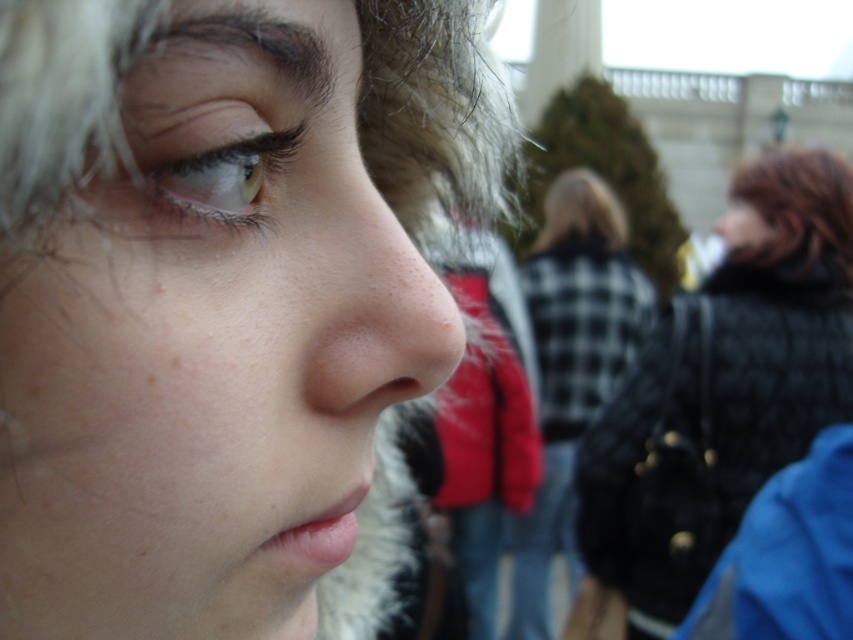
Looking at this image, measure the distance from plaid fabric coat at center to smooth skin nose at center.

plaid fabric coat at center is 29.74 meters from smooth skin nose at center.

What do you see at coordinates (572, 365) in the screenshot?
I see `plaid fabric coat at center` at bounding box center [572, 365].

The image size is (853, 640). Find the location of `plaid fabric coat at center`. plaid fabric coat at center is located at coordinates (572, 365).

Is black quilted coat at upper right shorter than matte black nose at center?

No, black quilted coat at upper right is not shorter than matte black nose at center.

The height and width of the screenshot is (640, 853). Describe the element at coordinates (723, 388) in the screenshot. I see `black quilted coat at upper right` at that location.

Locate an element on the screen. black quilted coat at upper right is located at coordinates [x=723, y=388].

Can you confirm if blondehair at center is positioned above smooth skin nose at center?

Yes, blondehair at center is above smooth skin nose at center.

Is point (431, 61) farther from camera compared to point (415, 300)?

Yes.

Find the location of a particular element. The image size is (853, 640). blondehair at center is located at coordinates (434, 109).